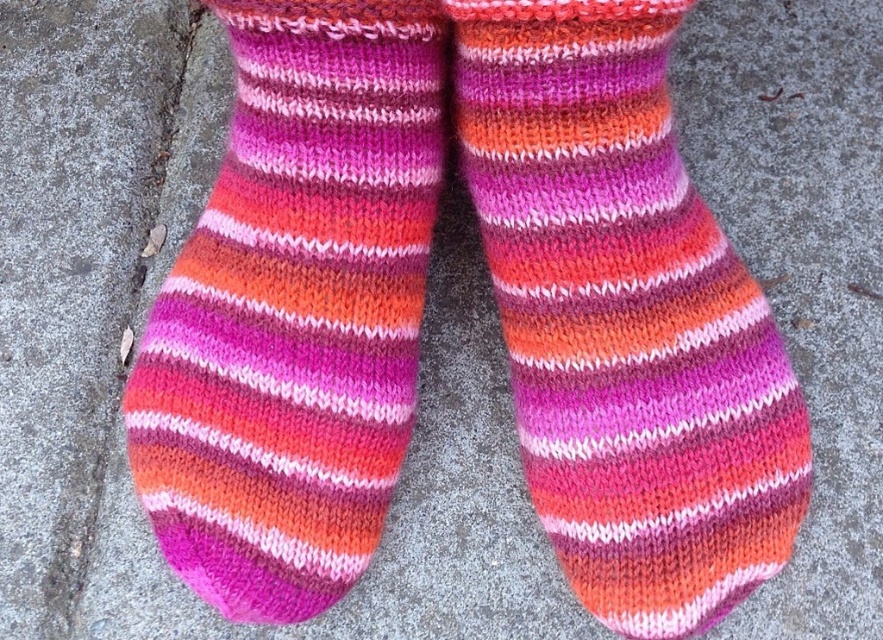
You are a sock seller who needs to display two different socks in your store window. You have a striped wool sock at center and a striped woolen sock at center. Which sock should you place higher up on the display to make them both visible?

The striped wool sock at center is shorter than the striped woolen sock at center, so you should place the striped wool sock at center higher up to ensure both are visible.

You are organizing a sock display and need to arrange the striped wool sock at center and the striped woolen sock at center in a specific order. According to their positions in the image, which sock should be placed to the left in the display?

The striped woolen sock at center should be placed to the left in the display because the striped wool sock at center is positioned on the right side of it.

You are organizing a sock display and need to arrange the striped wool sock at center and the striped woolen sock at center. According to the image, which sock should be placed in front to match the original arrangement?

The striped wool sock at center should be placed in front of the striped woolen sock at center to match the original arrangement.